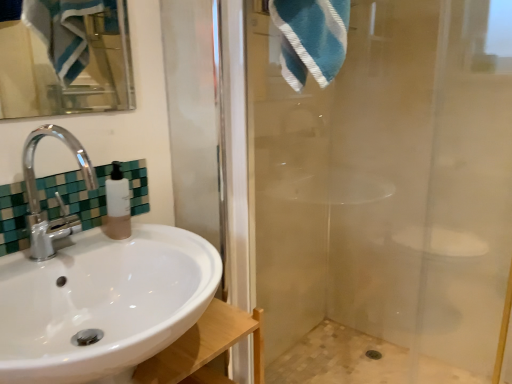
What is the approximate height of blue striped towel at upper right?

blue striped towel at upper right is 20.35 centimeters in height.

What do you see at coordinates (117, 205) in the screenshot? I see `translucent plastic soap dispenser at sink` at bounding box center [117, 205].

This screenshot has width=512, height=384. What do you see at coordinates (75, 196) in the screenshot?
I see `green mosaic tile at upper left` at bounding box center [75, 196].

You are a GUI agent. You are given a task and a screenshot of the screen. Output one action in this format:
    pyautogui.click(x=<x>, y=<y>)
    Task: Click on the transparent glass shower door at right
    This screenshot has height=384, width=512.
    Given the screenshot: What is the action you would take?
    pyautogui.click(x=389, y=182)

Find the location of `blue striped towel at upper right`. blue striped towel at upper right is located at coordinates (311, 38).

Is translucent plastic soap dispenser at sink with white glossy sink at lower left?

translucent plastic soap dispenser at sink is not next to white glossy sink at lower left, and they're not touching.

Which object is further away from the camera taking this photo, translucent plastic soap dispenser at sink or white glossy sink at lower left?

Positioned behind is translucent plastic soap dispenser at sink.

From the image's perspective, who appears lower, translucent plastic soap dispenser at sink or white glossy sink at lower left?

white glossy sink at lower left, from the image's perspective.

Does point (126, 189) come farther from viewer compared to point (36, 232)?

Yes, point (126, 189) is farther from viewer.

Does beige mosaic tile bath at lower right have a lesser height compared to blue striped towel at upper right?

Correct, beige mosaic tile bath at lower right is not as tall as blue striped towel at upper right.

Who is more distant, beige mosaic tile bath at lower right or blue striped towel at upper right?

beige mosaic tile bath at lower right is behind.

Is point (355, 347) more distant than point (285, 32)?

Yes, point (355, 347) is behind point (285, 32).

I want to click on bath towel that is above the beige mosaic tile bath at lower right (from the image's perspective), so click(x=311, y=38).

Could transparent glass shower door at right be considered to be inside white glossy sink at lower left?

Definitely not — transparent glass shower door at right is not inside white glossy sink at lower left.

Is white glossy sink at lower left oriented towards transparent glass shower door at right?

No, white glossy sink at lower left is not oriented towards transparent glass shower door at right.

Based on the photo, how distant is white glossy sink at lower left from transparent glass shower door at right?

They are 33.17 inches apart.

You are a GUI agent. You are given a task and a screenshot of the screen. Output one action in this format:
    pyautogui.click(x=<x>, y=<y>)
    Task: Click on the soap dispenser on the left side of blue striped towel at upper right
    The height and width of the screenshot is (384, 512).
    Given the screenshot: What is the action you would take?
    pyautogui.click(x=117, y=205)

Would you say translucent plastic soap dispenser at sink is to the left or to the right of blue striped towel at upper right in the picture?

translucent plastic soap dispenser at sink is to the left of blue striped towel at upper right.

Considering the relative sizes of translucent plastic soap dispenser at sink and blue striped towel at upper right in the image provided, is translucent plastic soap dispenser at sink bigger than blue striped towel at upper right?

No, translucent plastic soap dispenser at sink is not bigger than blue striped towel at upper right.

Is translucent plastic soap dispenser at sink oriented away from blue striped towel at upper right?

translucent plastic soap dispenser at sink does not have its back to blue striped towel at upper right.

Is blue striped towel at upper right positioned behind beige mosaic tile bath at lower right?

No, blue striped towel at upper right is closer to the viewer.

Could you tell me if blue striped towel at upper right is turned towards beige mosaic tile bath at lower right?

No, blue striped towel at upper right does not turn towards beige mosaic tile bath at lower right.

Which point is more forward, (337,52) or (402,357)?

The point (337,52) is in front.

From the image's perspective, which is below, blue striped towel at upper right or beige mosaic tile bath at lower right?

beige mosaic tile bath at lower right.

Considering the relative sizes of blue striped towel at upper right and green mosaic tile at upper left in the image provided, is blue striped towel at upper right taller than green mosaic tile at upper left?

Correct, blue striped towel at upper right is much taller as green mosaic tile at upper left.

From a real-world perspective, is blue striped towel at upper right positioned over green mosaic tile at upper left based on gravity?

Yes, from a real-world perspective, blue striped towel at upper right is above green mosaic tile at upper left.

Based on the photo, which is farther from the camera, (324,36) or (19,243)?

Point (19,243)

Considering the sizes of blue striped towel at upper right and green mosaic tile at upper left in the image, is blue striped towel at upper right wider or thinner than green mosaic tile at upper left?

In the image, blue striped towel at upper right appears to be wider than green mosaic tile at upper left.

Considering the sizes of objects white glossy sink at lower left and green mosaic tile at upper left in the image provided, who is shorter, white glossy sink at lower left or green mosaic tile at upper left?

With less height is green mosaic tile at upper left.

Would you say white glossy sink at lower left is inside or outside green mosaic tile at upper left?

white glossy sink at lower left is outside green mosaic tile at upper left.

In the scene shown: From a real-world perspective, does white glossy sink at lower left sit lower than green mosaic tile at upper left?

Yes, from a real-world perspective, white glossy sink at lower left is under green mosaic tile at upper left.

Locate an element on the screen. Image resolution: width=512 pixels, height=384 pixels. soap dispenser lying on the left of white glossy sink at lower left is located at coordinates (117, 205).

You are a GUI agent. You are given a task and a screenshot of the screen. Output one action in this format:
    pyautogui.click(x=<x>, y=<y>)
    Task: Click on the bath below the blue striped towel at upper right (from the image's perspective)
    Image resolution: width=512 pixels, height=384 pixels.
    Given the screenshot: What is the action you would take?
    pyautogui.click(x=358, y=361)

In the scene shown: Looking at the image, which one is located further to translucent plastic soap dispenser at sink, transparent glass shower door at right or green mosaic tile at upper left?

transparent glass shower door at right.

Estimate the real-world distances between objects in this image. Which object is further from beige mosaic tile bath at lower right, white glossy sink at lower left or transparent glass shower door at right?

white glossy sink at lower left is further to beige mosaic tile bath at lower right.

From the image, which object appears to be nearer to transparent glass shower door at right, blue striped towel at upper right or beige mosaic tile bath at lower right?

The object closer to transparent glass shower door at right is beige mosaic tile bath at lower right.

Considering their positions, is transparent glass shower door at right positioned further to beige mosaic tile bath at lower right than white glossy sink at lower left?

The object further to beige mosaic tile bath at lower right is white glossy sink at lower left.

Looking at the image, which one is located further to white glossy sink at lower left, blue striped towel at upper right or transparent glass shower door at right?

transparent glass shower door at right lies further to white glossy sink at lower left than the other object.

From the picture: When comparing their distances from transparent glass shower door at right, does blue striped towel at upper right or green mosaic tile at upper left seem further?

Among the two, green mosaic tile at upper left is located further to transparent glass shower door at right.

Based on their spatial positions, is white glossy sink at lower left or green mosaic tile at upper left closer to beige mosaic tile bath at lower right?

Among the two, white glossy sink at lower left is located nearer to beige mosaic tile bath at lower right.

Looking at the image, which one is located further to blue striped towel at upper right, white glossy sink at lower left or beige mosaic tile bath at lower right?

The object further to blue striped towel at upper right is beige mosaic tile bath at lower right.

This screenshot has height=384, width=512. In order to click on sink between green mosaic tile at upper left and beige mosaic tile bath at lower right from left to right in this screenshot , I will do `click(97, 292)`.

The width and height of the screenshot is (512, 384). I want to click on sink situated between translucent plastic soap dispenser at sink and beige mosaic tile bath at lower right from left to right, so click(x=97, y=292).

The height and width of the screenshot is (384, 512). Find the location of `sink between green mosaic tile at upper left and transparent glass shower door at right in the horizontal direction`. sink between green mosaic tile at upper left and transparent glass shower door at right in the horizontal direction is located at coordinates (97, 292).

Locate an element on the screen. shower door situated between green mosaic tile at upper left and beige mosaic tile bath at lower right from left to right is located at coordinates (389, 182).